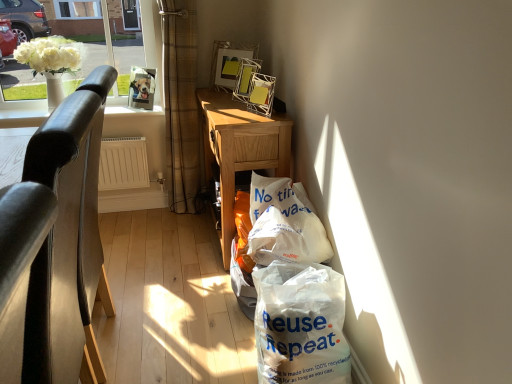
Find the location of a particular element. free spot to the right of black leather chair at left is located at coordinates (189, 333).